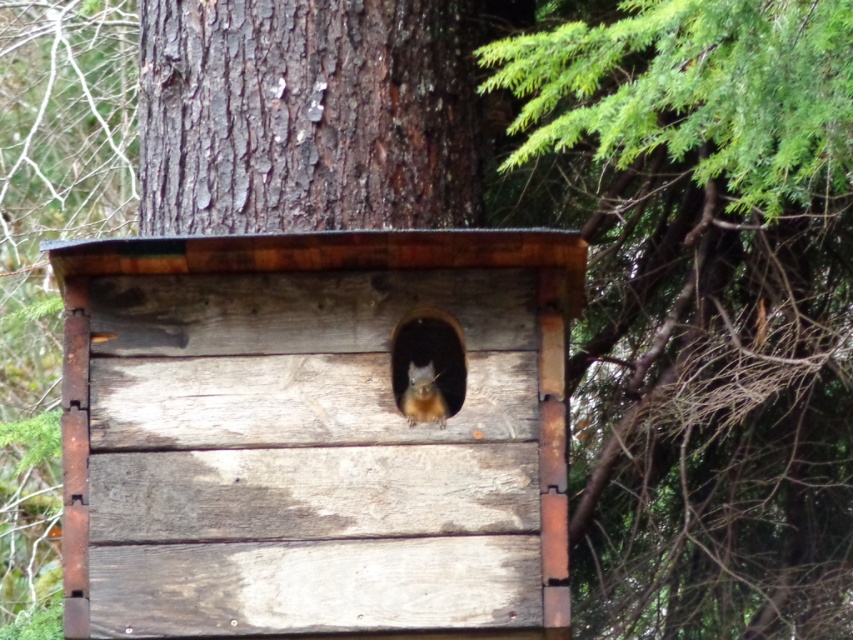
Question: Estimate the real-world distances between objects in this image. Which object is farther from the smooth wood hole at center?

Choices:
 (A) orange fur squirrel at center
 (B) dark brown rough bark at upper center
 (C) weathered wood at center

Answer: (B)

Question: Does dark brown rough bark at upper center have a lesser width compared to smooth wood hole at center?

Choices:
 (A) yes
 (B) no

Answer: (B)

Question: Is dark brown rough bark at upper center in front of smooth wood hole at center?

Choices:
 (A) no
 (B) yes

Answer: (A)

Question: Can you confirm if green leafy tree at upper right is bigger than orange fur squirrel at center?

Choices:
 (A) yes
 (B) no

Answer: (A)

Question: Which point appears farthest from the camera in this image?

Choices:
 (A) (393, 355)
 (B) (212, 189)

Answer: (B)

Question: Estimate the real-world distances between objects in this image. Which object is closer to the dark brown rough bark at upper center?

Choices:
 (A) orange fur squirrel at center
 (B) smooth wood hole at center

Answer: (B)